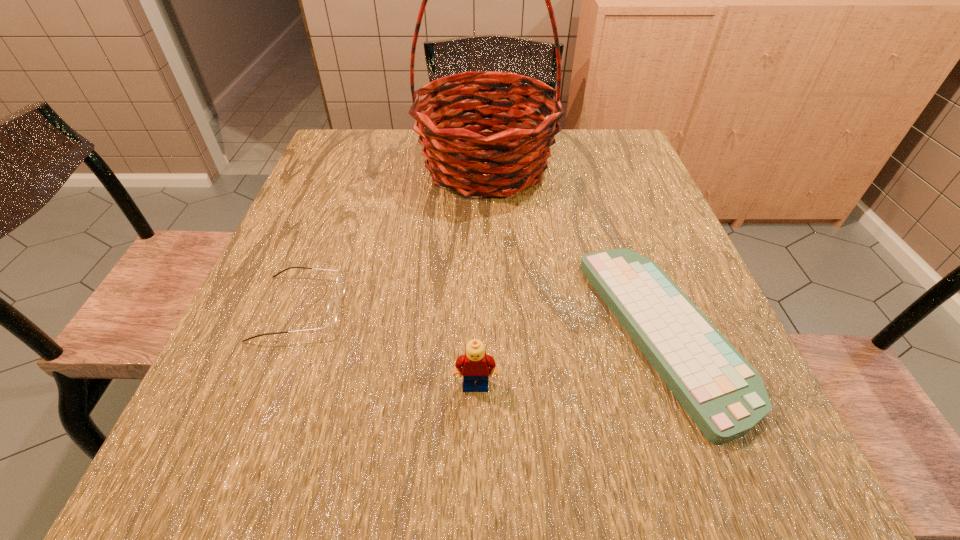
At what (x,y) coordinates should I click in order to perform the action: click on free point located 0.370m on the back of the rightmost object. Please return your answer as a coordinate pair (x, y). The width and height of the screenshot is (960, 540). Looking at the image, I should click on (600, 165).

Where is `object located in the far edge section of the desktop`? object located in the far edge section of the desktop is located at coordinates (457, 156).

Image resolution: width=960 pixels, height=540 pixels. What are the coordinates of `object located at the near edge` in the screenshot? It's located at (725, 396).

At what (x,y) coordinates should I click in order to perform the action: click on object at the left edge. Please return your answer as a coordinate pair (x, y). This screenshot has width=960, height=540. Looking at the image, I should click on (340, 282).

I want to click on object that is at the right edge, so click(x=725, y=396).

At what (x,y) coordinates should I click in order to perform the action: click on object at the near right corner. Please return your answer as a coordinate pair (x, y). Looking at the image, I should click on (725, 396).

This screenshot has height=540, width=960. In the image, there is a desktop. Find the location of `free space at the far edge`. free space at the far edge is located at coordinates (400, 143).

In the image, there is a desktop. Identify the location of vacant space at the near edge. The width and height of the screenshot is (960, 540). (346, 511).

In the image, there is a desktop. Where is `free space at the left edge`? This screenshot has height=540, width=960. free space at the left edge is located at coordinates (316, 265).

This screenshot has height=540, width=960. In order to click on vacant space at the right edge of the desktop in this screenshot , I will do `click(608, 174)`.